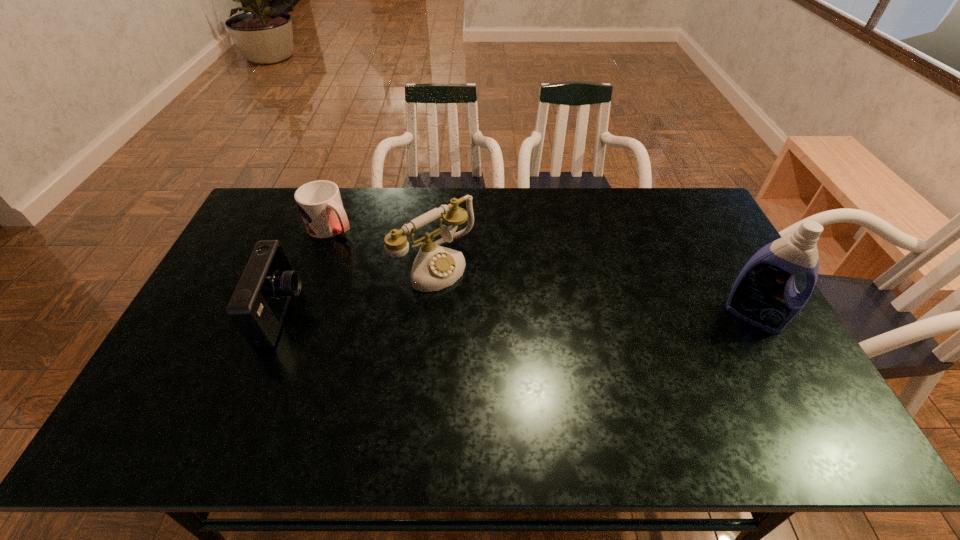
The image size is (960, 540). Identify the location of blank region between the tallest object and the mug. (542, 271).

The height and width of the screenshot is (540, 960). I want to click on blank region between the telephone and the third tallest object, so click(x=359, y=288).

Select which object is the third closest to the camera. Please provide its 2D coordinates. Your answer should be formatted as a tuple, i.e. [(x, y)], where the tuple contains the x and y coordinates of a point satisfying the conditions above.

[(764, 294)]

Find the location of a particular element. Image resolution: width=960 pixels, height=540 pixels. the second closest object relative to the shortest object is located at coordinates (257, 308).

Identify the location of vacant area that satisfies the following two spatial constraints: 1. on the front side of the telephone; 2. on the right side of the tallest object. (430, 315).

Find the location of a particular element. This screenshot has width=960, height=540. free space that satisfies the following two spatial constraints: 1. on the front side of the detergent; 2. on the left side of the telephone is located at coordinates (430, 315).

The height and width of the screenshot is (540, 960). In order to click on blank area in the image that satisfies the following two spatial constraints: 1. on the front side of the tallest object; 2. on the left side of the third shortest object in this screenshot , I will do `click(430, 315)`.